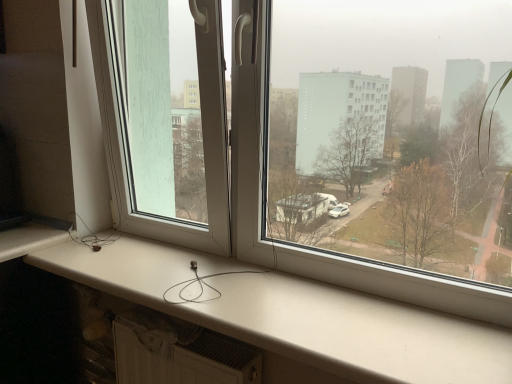
Locate an element on the screen. This screenshot has width=512, height=384. empty space that is ontop of white matte window sill at lower center (from a real-world perspective) is located at coordinates (236, 291).